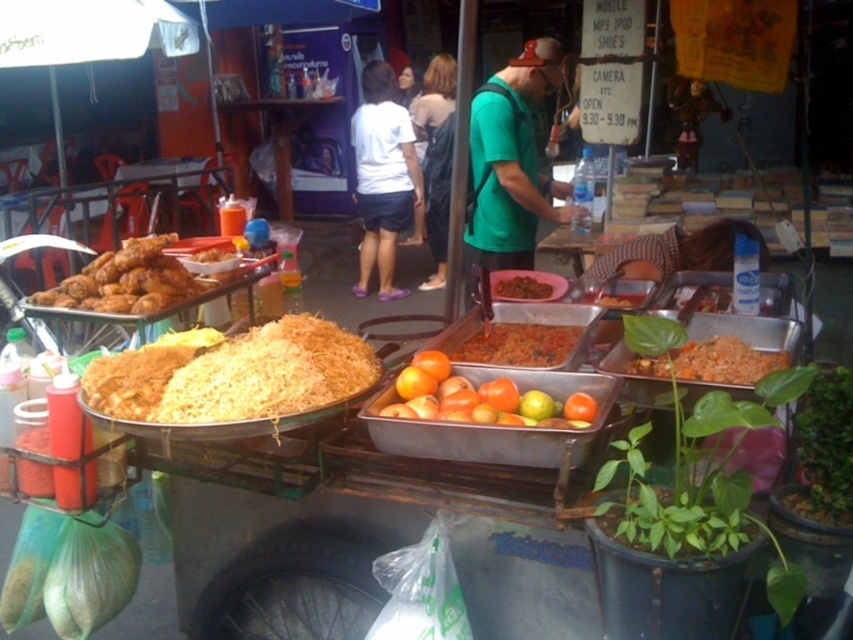
Question: Estimate the real-world distances between objects in this image. Which object is farther from the white matte shirt at center?

Choices:
 (A) yellow fried rice at center
 (B) orange matte tomatoes at center
 (C) dark blue dress at center

Answer: (A)

Question: Which object is closer to the camera taking this photo?

Choices:
 (A) yellow fried rice at center
 (B) green matte shirt at center
 (C) shiny red sauce at center
 (D) brown matte fried rice at center

Answer: (A)

Question: Which is farther from the orange matte fruit at center?

Choices:
 (A) shiny red sauce at center
 (B) green matte shirt at center

Answer: (B)

Question: From the image, what is the correct spatial relationship of orange matte fruit at center in relation to brown matte fried rice at center?

Choices:
 (A) above
 (B) below

Answer: (B)

Question: Can you confirm if green matte shirt at center is positioned to the right of shiny red sauce at center?

Choices:
 (A) yes
 (B) no

Answer: (A)

Question: Considering the relative positions of yellow fried rice at center and green matte shirt at center in the image provided, where is yellow fried rice at center located with respect to green matte shirt at center?

Choices:
 (A) right
 (B) left

Answer: (B)